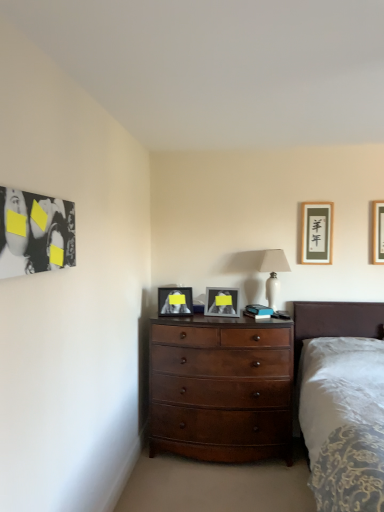
Question: Does white ceramic lamp at upper center have a greater height compared to matte black picture frame at upper right, the second picture frame positioned from the right?

Choices:
 (A) no
 (B) yes

Answer: (B)

Question: Can you confirm if white ceramic lamp at upper center is shorter than matte black picture frame at upper right, the 3th picture frame when ordered from left to right?

Choices:
 (A) no
 (B) yes

Answer: (A)

Question: Can you confirm if white ceramic lamp at upper center is positioned to the right of matte black picture frame at upper right, the 3th picture frame when ordered from left to right?

Choices:
 (A) yes
 (B) no

Answer: (B)

Question: Can we say white ceramic lamp at upper center lies outside matte black picture frame at upper right, the second picture frame positioned from the right?

Choices:
 (A) yes
 (B) no

Answer: (A)

Question: Is white ceramic lamp at upper center placed right next to matte black picture frame at upper right, the 3th picture frame when ordered from left to right?

Choices:
 (A) yes
 (B) no

Answer: (B)

Question: From a real-world perspective, is wooden picture frame at upper right, marked as the 1th picture frame in a right-to-left arrangement, above or below white ceramic lamp at upper center?

Choices:
 (A) below
 (B) above

Answer: (B)

Question: In terms of height, does wooden picture frame at upper right, marked as the 1th picture frame in a right-to-left arrangement, look taller or shorter compared to white ceramic lamp at upper center?

Choices:
 (A) tall
 (B) short

Answer: (B)

Question: Considering their positions, is wooden picture frame at upper right, the fourth picture frame in the left-to-right sequence, located in front of or behind white ceramic lamp at upper center?

Choices:
 (A) front
 (B) behind

Answer: (B)

Question: From the image's perspective, is wooden picture frame at upper right, the fourth picture frame in the left-to-right sequence, positioned above or below white ceramic lamp at upper center?

Choices:
 (A) below
 (B) above

Answer: (B)

Question: In the image, is mahogany wood dresser at center positioned in front of or behind white ceramic lamp at upper center?

Choices:
 (A) front
 (B) behind

Answer: (A)

Question: From their relative heights in the image, would you say mahogany wood dresser at center is taller or shorter than white ceramic lamp at upper center?

Choices:
 (A) tall
 (B) short

Answer: (A)

Question: Considering the positions of point (230, 340) and point (269, 258), is point (230, 340) closer or farther from the camera than point (269, 258)?

Choices:
 (A) farther
 (B) closer

Answer: (B)

Question: From the image's perspective, relative to white ceramic lamp at upper center, is mahogany wood dresser at center above or below?

Choices:
 (A) above
 (B) below

Answer: (B)

Question: Visually, is white ceramic lamp at upper center positioned to the left or to the right of mahogany wood dresser at center?

Choices:
 (A) left
 (B) right

Answer: (B)

Question: Is point (269, 262) positioned closer to the camera than point (182, 352)?

Choices:
 (A) closer
 (B) farther

Answer: (B)